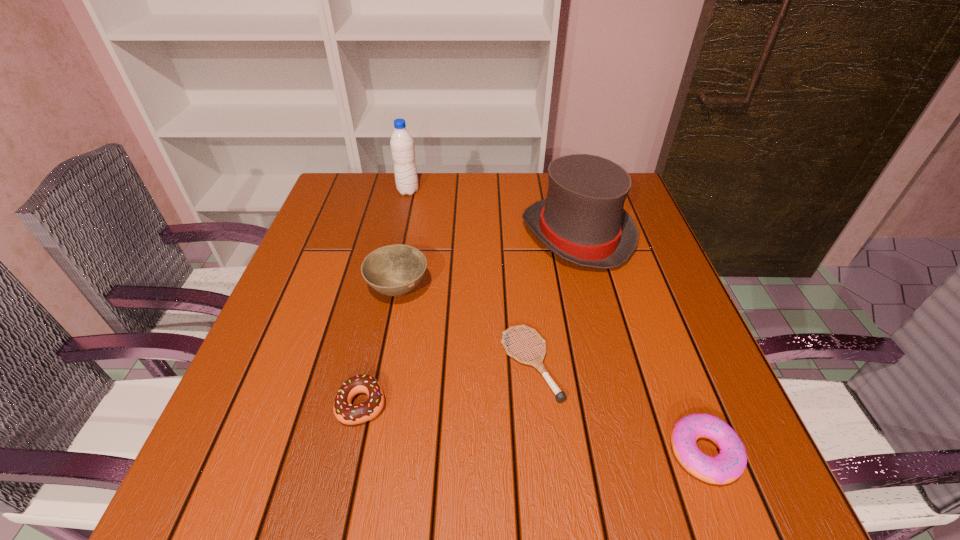
Find the location of `water bottle`. water bottle is located at coordinates (402, 144).

The height and width of the screenshot is (540, 960). I want to click on the farthest object, so click(x=402, y=144).

At what (x,y) coordinates should I click in order to perform the action: click on the fifth shortest object. Please return your answer as a coordinate pair (x, y). Looking at the image, I should click on (582, 220).

Where is `the third tallest object`? The image size is (960, 540). the third tallest object is located at coordinates (394, 270).

The height and width of the screenshot is (540, 960). Find the location of `the left doughnut`. the left doughnut is located at coordinates (344, 411).

You are a GUI agent. You are given a task and a screenshot of the screen. Output one action in this format:
    pyautogui.click(x=<x>, y=<y>)
    Task: Click on the right doughnut
    Image resolution: width=960 pixels, height=540 pixels.
    Given the screenshot: What is the action you would take?
    pyautogui.click(x=726, y=467)

Locate an element on the screen. This screenshot has height=540, width=960. the shortest object is located at coordinates (560, 396).

Locate an element on the screen. vacant space located 0.070m on the back of the tallest object is located at coordinates (412, 173).

Locate an element on the screen. The height and width of the screenshot is (540, 960). vacant space situated 0.170m on the left of the fifth shortest object is located at coordinates (x=456, y=235).

This screenshot has width=960, height=540. Identify the location of free space located 0.130m on the right of the third tallest object. (488, 289).